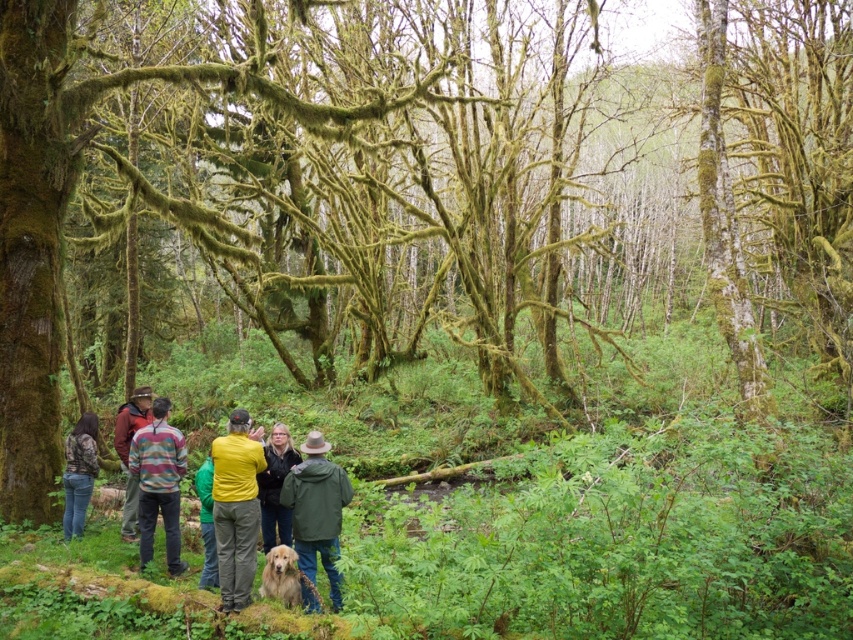
Question: Is striped sweater at center positioned before camouflage jacket at lower left?

Choices:
 (A) yes
 (B) no

Answer: (A)

Question: Which is farther from the matte brown jacket at center?

Choices:
 (A) green textured jacket at center
 (B) striped sweater at center

Answer: (A)

Question: Which point appears closest to the camera in this image?

Choices:
 (A) (219, 522)
 (B) (206, 465)

Answer: (A)

Question: Can you confirm if green matte jacket at center is positioned below matte brown jacket at center?

Choices:
 (A) no
 (B) yes

Answer: (B)

Question: Does green matte jacket at center appear on the left side of striped sweater at center?

Choices:
 (A) yes
 (B) no

Answer: (B)

Question: Which object is farther from the camera taking this photo?

Choices:
 (A) striped sweater at center
 (B) green textured jacket at center

Answer: (A)